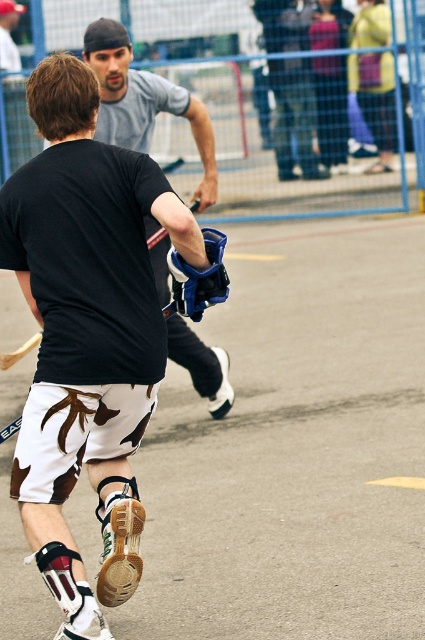
Based on the photo, you are a referee observing the field hockey game. You notice the white leather shorts at center and the matte gray shirt at upper center. Which player is positioned more to the left side of the field?

The white leather shorts at center is positioned on the left side of matte gray shirt at upper center, so the player wearing white leather shorts at center is more to the left.